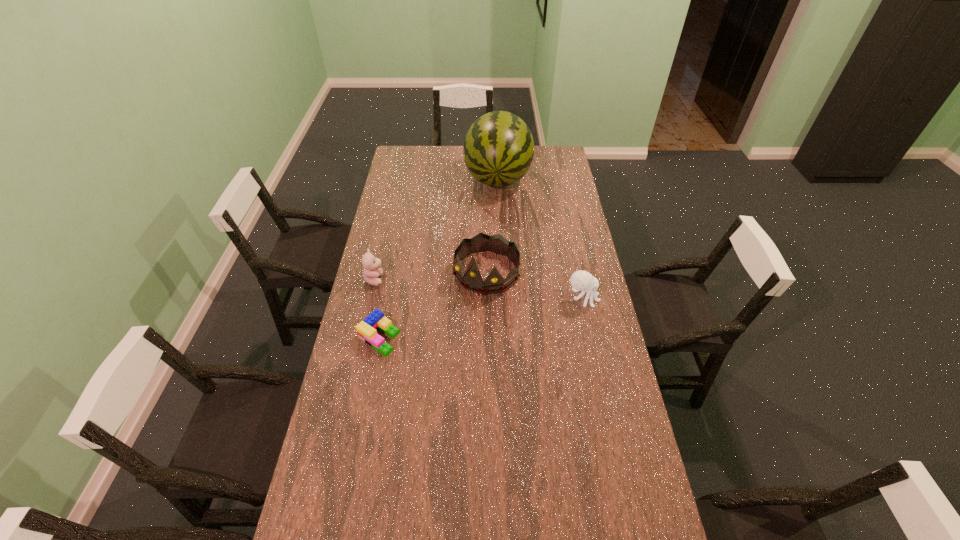
You are a GUI agent. You are given a task and a screenshot of the screen. Output one action in this format:
    pyautogui.click(x=<x>, y=<y>)
    Task: Click on the free space on the desktop that is between the Lego and the octopus and is positioned at the stem end of the farthest object
    Image resolution: width=960 pixels, height=540 pixels.
    Given the screenshot: What is the action you would take?
    pyautogui.click(x=482, y=318)

Identify the location of vacant spot on the desktop that is between the shortest object and the rightmost object and is positioned at the front of the second tallest object with jewels. This screenshot has height=540, width=960. (454, 323).

Find the location of a particular element. vacant spot on the desktop that is between the Lego and the octopus and is positioned at the face of the teddy bear is located at coordinates (512, 312).